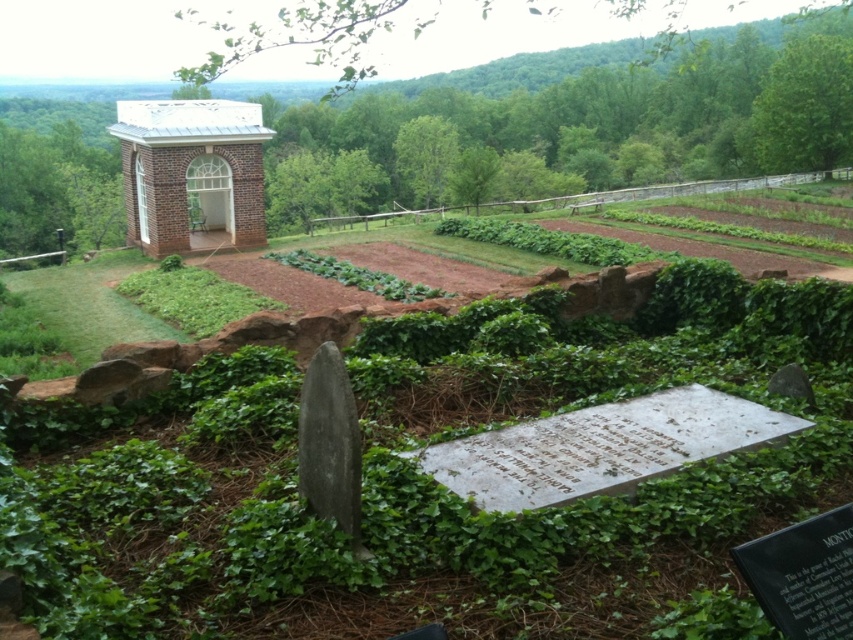
You are standing at the point with coordinates point (221, 118) and want to walk towards the point with coordinates point (753, 166). Which direction should you move relative to your current position?

Since point (753, 166) is behind point (221, 118), you should move backward to reach it.

Based on the scene description, if you were standing at the grave marker surrounded by ivy, which object would appear closer to you, the green leafy plants at center or the white brick chapel at upper left?

The green leafy plants at center would appear closer since they are positioned at the center of the scene, whereas the white brick chapel at upper left is located further back in the upper left area, making the green leafy plants at center nearer to the grave marker.

Based on the scene description, where exactly are the green leafy plants at center located?

The green leafy plants at center are located at point (564, 129).